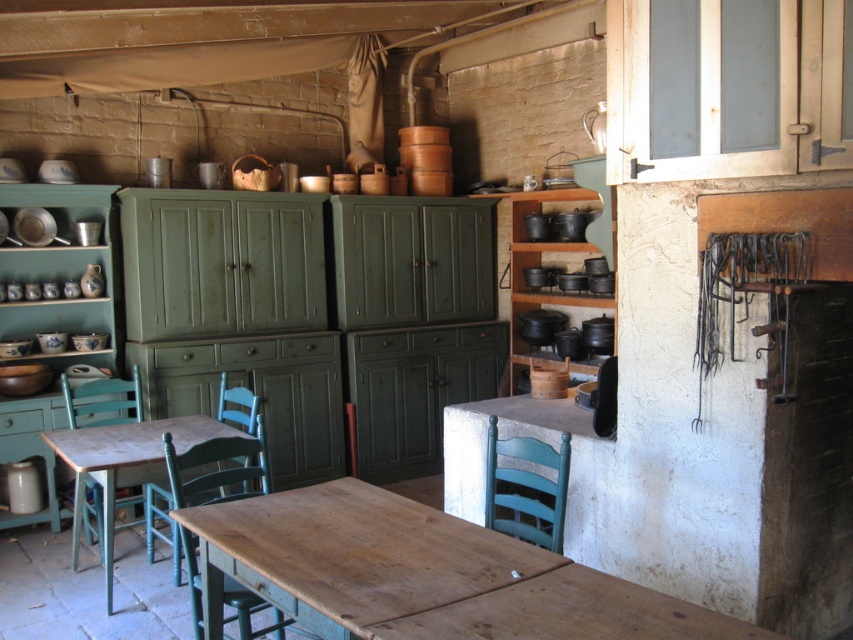
Question: Considering the real-world distances, which object is closest to the teal wood chair at lower center?

Choices:
 (A) teal painted wood chair at lower left
 (B) wooden chair at center
 (C) wooden table at center
 (D) green wood chair at center

Answer: (C)

Question: Is wooden chair at center closer to the viewer compared to green wood chair at center?

Choices:
 (A) yes
 (B) no

Answer: (A)

Question: Which object is farther from the camera taking this photo?

Choices:
 (A) wooden table at lower left
 (B) teal wood chair at lower center
 (C) wooden table at center

Answer: (A)

Question: Does wooden chair at center have a greater width compared to teal painted wood chair at lower left?

Choices:
 (A) yes
 (B) no

Answer: (A)

Question: Does wooden table at lower left lie behind teal painted wood chair at lower left?

Choices:
 (A) yes
 (B) no

Answer: (B)

Question: Among these points, which one is farthest from the camera?

Choices:
 (A) (262, 458)
 (B) (218, 426)
 (C) (502, 528)
 (D) (96, 403)

Answer: (D)